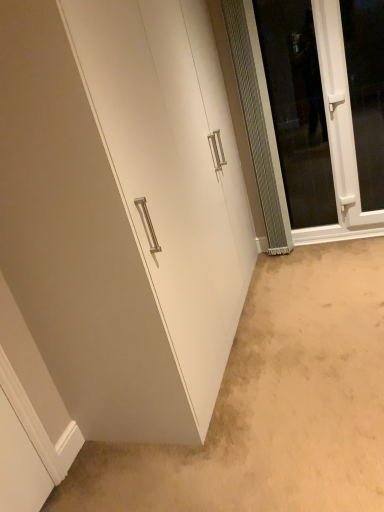
Question: Is white matte cabinet at lower left further to camera compared to white plastic window at upper right?

Choices:
 (A) no
 (B) yes

Answer: (A)

Question: Is white matte cabinet at lower left next to white plastic window at upper right?

Choices:
 (A) yes
 (B) no

Answer: (B)

Question: Can we say white matte cabinet at lower left lies outside white plastic window at upper right?

Choices:
 (A) no
 (B) yes

Answer: (B)

Question: Does white matte cabinet at lower left come in front of white plastic window at upper right?

Choices:
 (A) yes
 (B) no

Answer: (A)

Question: Are white matte cabinet at lower left and white plastic window at upper right located far from each other?

Choices:
 (A) yes
 (B) no

Answer: (A)

Question: Considering the positions of point (109, 123) and point (314, 352), is point (109, 123) closer or farther from the camera than point (314, 352)?

Choices:
 (A) closer
 (B) farther

Answer: (A)

Question: From a real-world perspective, is white matte cabinet at center physically located above or below white matte cabinet at lower left?

Choices:
 (A) below
 (B) above

Answer: (B)

Question: Is white matte cabinet at center bigger or smaller than white matte cabinet at lower left?

Choices:
 (A) big
 (B) small

Answer: (A)

Question: Visually, is white matte cabinet at center positioned to the left or to the right of white matte cabinet at lower left?

Choices:
 (A) left
 (B) right

Answer: (A)

Question: Based on their positions, is white plastic window at upper right located to the left or right of white matte cabinet at lower left?

Choices:
 (A) left
 (B) right

Answer: (B)

Question: Does point (360, 117) appear closer or farther from the camera than point (296, 430)?

Choices:
 (A) farther
 (B) closer

Answer: (A)

Question: Would you say white plastic window at upper right is inside or outside white matte cabinet at lower left?

Choices:
 (A) outside
 (B) inside

Answer: (A)

Question: From a real-world perspective, relative to white matte cabinet at lower left, is white plastic window at upper right vertically above or below?

Choices:
 (A) above
 (B) below

Answer: (A)

Question: Relative to clear glass screen door at right, is white plastic window at upper right in front or behind?

Choices:
 (A) behind
 (B) front

Answer: (B)

Question: From their relative heights in the image, would you say white plastic window at upper right is taller or shorter than clear glass screen door at right?

Choices:
 (A) short
 (B) tall

Answer: (A)